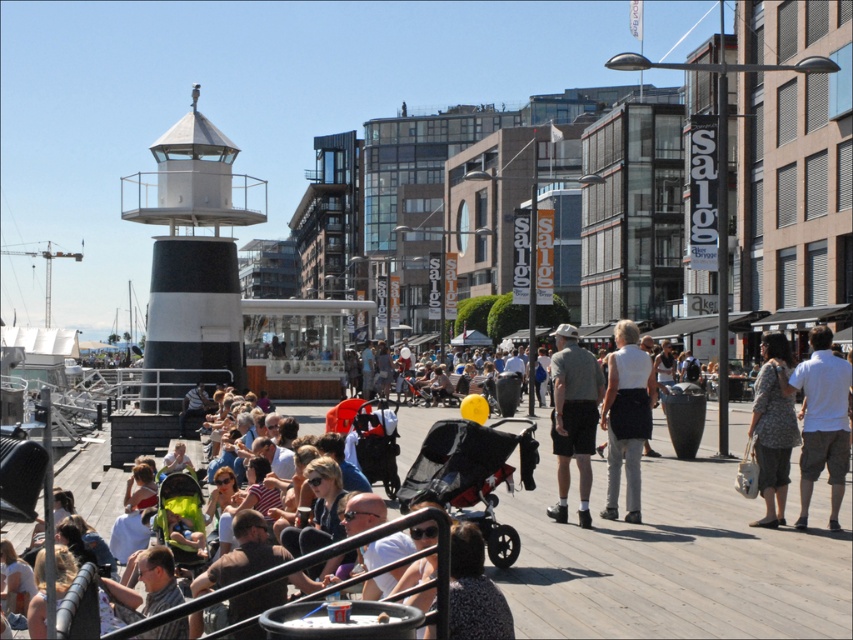
Question: Can you confirm if patterned fabric dress at center is smaller than matte black stroller at center?

Choices:
 (A) yes
 (B) no

Answer: (B)

Question: Can you confirm if white cotton shirt at center is positioned to the left of patterned fabric dress at center?

Choices:
 (A) yes
 (B) no

Answer: (A)

Question: Which point is closer to the camera taking this photo?

Choices:
 (A) (622, 368)
 (B) (792, 408)
 (C) (491, 497)

Answer: (C)

Question: Which of the following is the closest to the observer?

Choices:
 (A) pos(561,428)
 (B) pos(469,445)

Answer: (B)

Question: Which object is positioned farthest from the matte black stroller at center?

Choices:
 (A) white cotton shirt at center
 (B) patterned fabric dress at center

Answer: (B)

Question: Is white cotton shirt at center above white matte skirt at center?

Choices:
 (A) no
 (B) yes

Answer: (B)